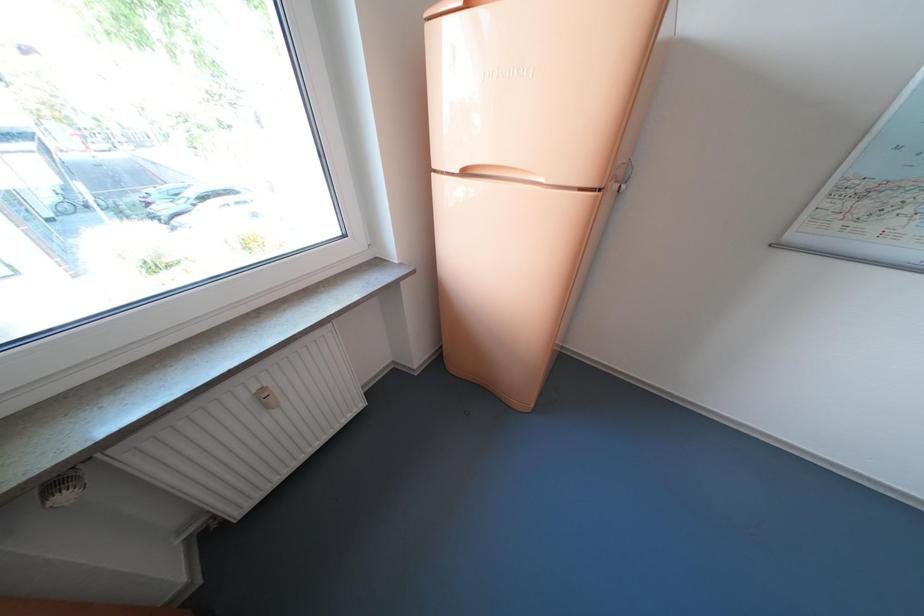
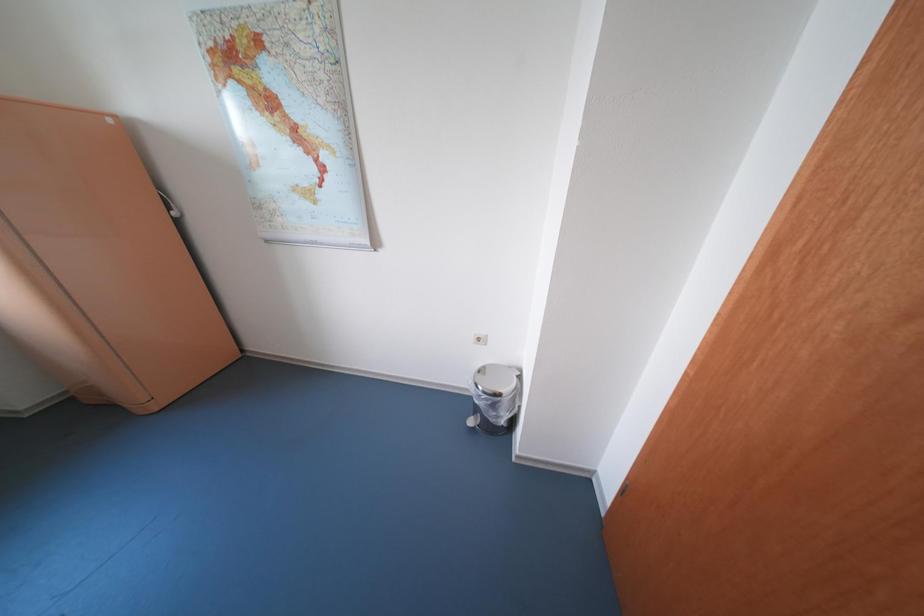
What movement of the cameraman would produce the second image?

The cameraman walked toward right, backward.